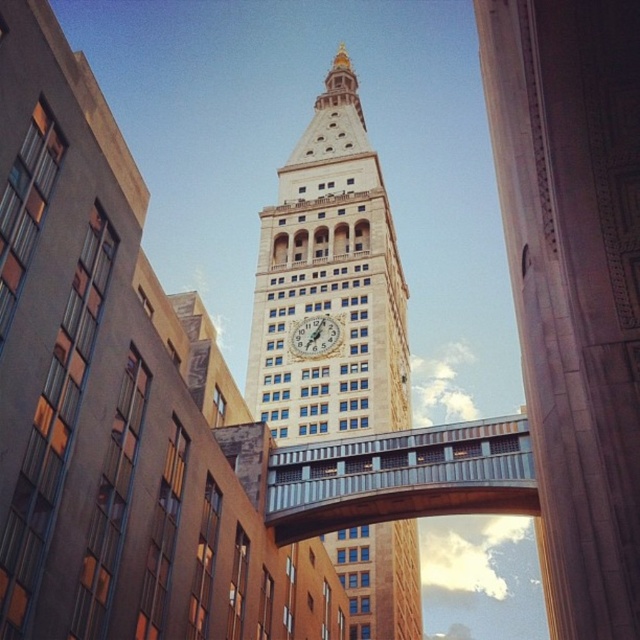
Question: Among these objects, which one is farthest from the camera?

Choices:
 (A) beige stone clock tower at center
 (B) white stone clock at center

Answer: (B)

Question: Which point is farther from the camera taking this photo?

Choices:
 (A) (524, 484)
 (B) (540, 202)
 (C) (291, 296)
 (D) (337, 326)

Answer: (C)

Question: Is beige stone clock tower at center positioned at the back of metal/textured bridge at center?

Choices:
 (A) yes
 (B) no

Answer: (A)

Question: Is marble column at center positioned before metal/textured bridge at center?

Choices:
 (A) yes
 (B) no

Answer: (A)

Question: Which object appears farthest from the camera in this image?

Choices:
 (A) marble column at center
 (B) metal/textured bridge at center
 (C) white stone clock at center
 (D) beige stone clock tower at center

Answer: (C)

Question: Can you confirm if marble column at center is smaller than metal/textured bridge at center?

Choices:
 (A) no
 (B) yes

Answer: (A)